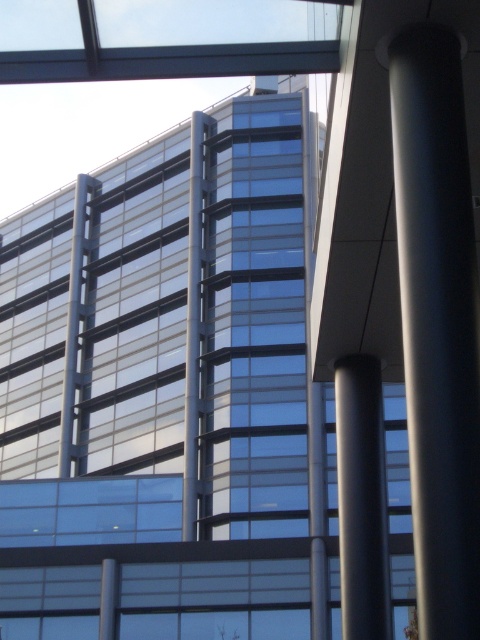
Does satin black column at right have a larger size compared to smooth gray column at center?

No.

Which of these two, satin black column at right or smooth gray column at center, stands shorter?

Standing shorter between the two is smooth gray column at center.

Between point (423, 28) and point (340, 472), which one is positioned behind?

Positioned behind is point (340, 472).

Locate an element on the screen. The width and height of the screenshot is (480, 640). satin black column at right is located at coordinates (437, 323).